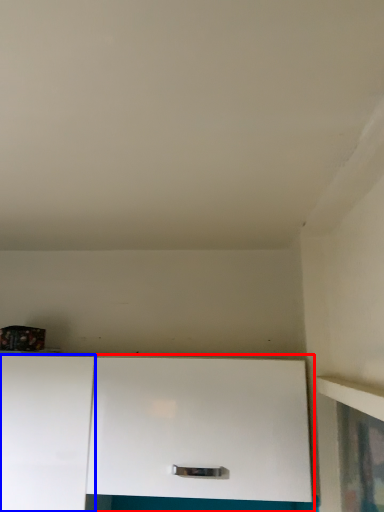
Question: Among these objects, which one is nearest to the camera, cabinetry (highlighted by a red box) or cabinetry (highlighted by a blue box)?

Choices:
 (A) cabinetry
 (B) cabinetry

Answer: (A)